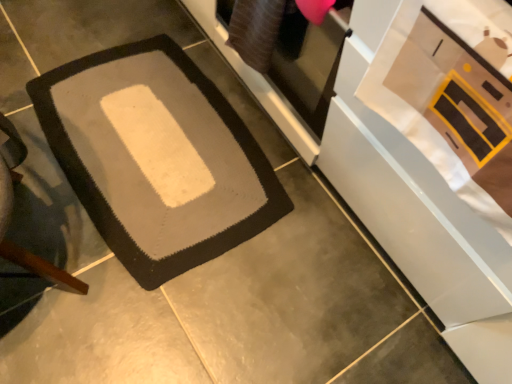
Measure the distance between knitted wool mat at center and camera.

The depth of knitted wool mat at center is 3.97 feet.

In order to face knitted wool mat at center, should I rotate leftwards or rightwards?

You should look left and rotate roughly 12.507 degrees.

This screenshot has height=384, width=512. What do you see at coordinates (157, 157) in the screenshot?
I see `knitted wool mat at center` at bounding box center [157, 157].

This screenshot has width=512, height=384. In order to click on knitted wool mat at center in this screenshot , I will do `click(157, 157)`.

You are a GUI agent. You are given a task and a screenshot of the screen. Output one action in this format:
    pyautogui.click(x=<x>, y=<y>)
    Task: Click on the knitted wool mat at center
    The width and height of the screenshot is (512, 384).
    Given the screenshot: What is the action you would take?
    pyautogui.click(x=157, y=157)